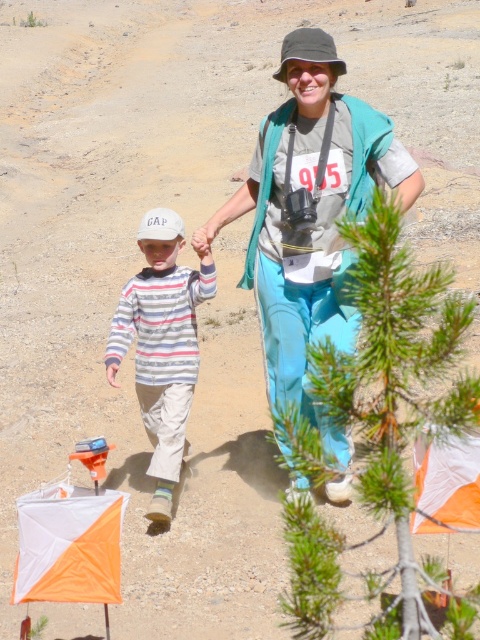
You are standing at the point marked by the coordinates point (168,413). You want to walk to the nearest water source, which is located 20 feet away from your current position. Can you reach it without exceeding the 20 feet limit?

The distance between point (168,413) and the viewer is 19.06 feet, which is within the 20 feet limit. Therefore, you can reach the water source without exceeding the limit.